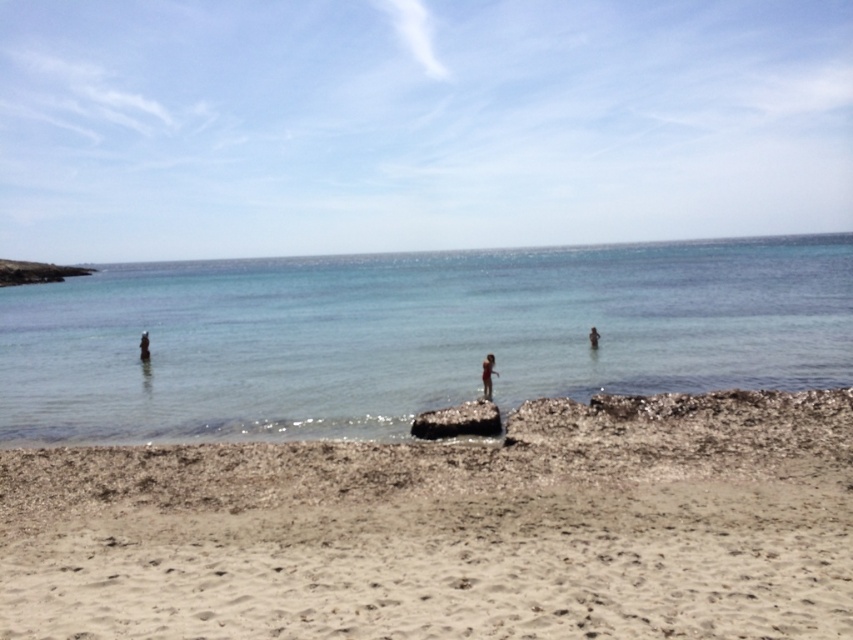
Question: Can you confirm if black shiny rock at center is smaller than skinny bikini swimmer at center?

Choices:
 (A) no
 (B) yes

Answer: (A)

Question: Does light beige sand at lower center appear over pink fabric person at center?

Choices:
 (A) no
 (B) yes

Answer: (A)

Question: Which of the following is the farthest from the observer?

Choices:
 (A) (469, 477)
 (B) (486, 406)
 (C) (148, 336)

Answer: (C)

Question: Does clear blue water at center have a greater width compared to pink fabric person at center?

Choices:
 (A) no
 (B) yes

Answer: (B)

Question: Which point is farther to the camera?

Choices:
 (A) clear blue water at center
 (B) skinny bikini swimmer at center
 (C) smooth skin person at left
 (D) black shiny rock at center

Answer: (C)

Question: Which of the following is the farthest from the observer?

Choices:
 (A) light beige sand at lower center
 (B) pink fabric person at center

Answer: (B)